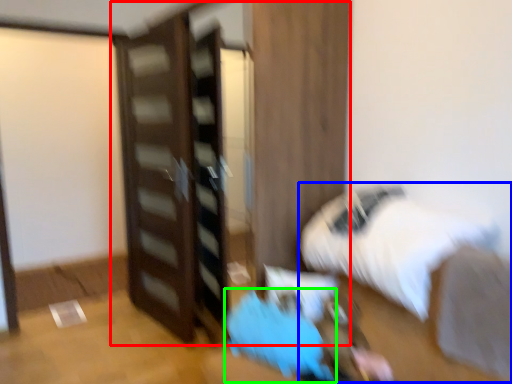
Question: Which object is the closest to the dresser (highlighted by a red box)? Choose among these: bed (highlighted by a blue box) or bean bag chair (highlighted by a green box).

Choices:
 (A) bed
 (B) bean bag chair

Answer: (B)